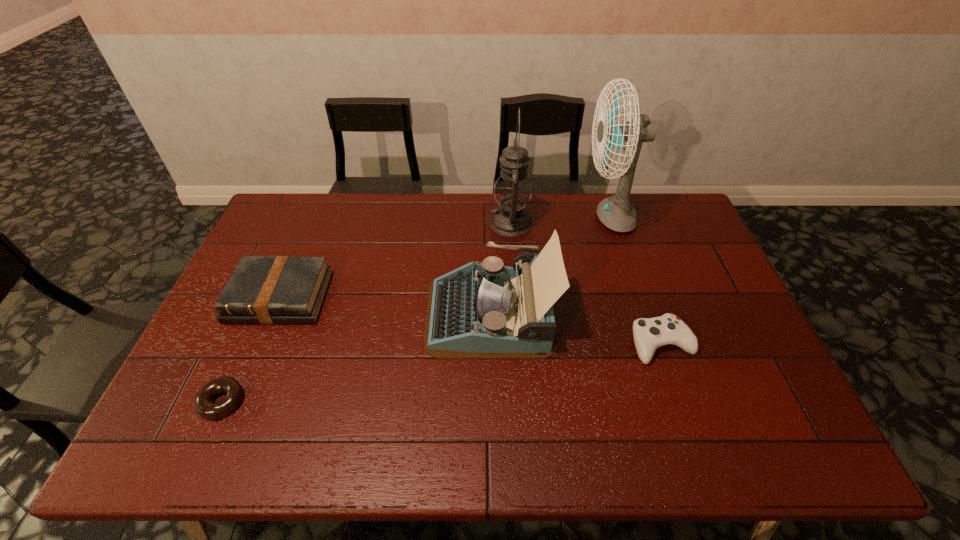
I want to click on vacant region located on the front of the oil lamp, so click(x=519, y=334).

Find the location of a particular element. The image size is (960, 540). vacant space located 0.270m on the typing side of the fourth shortest object is located at coordinates (332, 313).

The image size is (960, 540). I want to click on vacant space positioned on the typing side of the fourth shortest object, so click(307, 313).

Find the location of a particular element. The height and width of the screenshot is (540, 960). free space located on the typing side of the fourth shortest object is located at coordinates (371, 313).

You are a GUI agent. You are given a task and a screenshot of the screen. Output one action in this format:
    pyautogui.click(x=<x>, y=<y>)
    Task: Click on the free space located 0.330m on the spine side of the hardback book
    The image size is (960, 540).
    Given the screenshot: What is the action you would take?
    pyautogui.click(x=220, y=442)

You are a GUI agent. You are given a task and a screenshot of the screen. Output one action in this format:
    pyautogui.click(x=<x>, y=<y>)
    Task: Click on the vacant area situated 0.200m on the back of the second shortest object
    This screenshot has height=540, width=960.
    Given the screenshot: What is the action you would take?
    pyautogui.click(x=636, y=272)

Where is `vacant space located on the left of the nearest object`? The height and width of the screenshot is (540, 960). vacant space located on the left of the nearest object is located at coordinates (173, 401).

Locate an element on the screen. The image size is (960, 540). fan positioned at the far edge is located at coordinates (617, 213).

This screenshot has width=960, height=540. What are the coordinates of `oil lamp that is at the far edge` in the screenshot? It's located at [x=512, y=191].

Locate an element on the screen. object at the near edge is located at coordinates point(203,404).